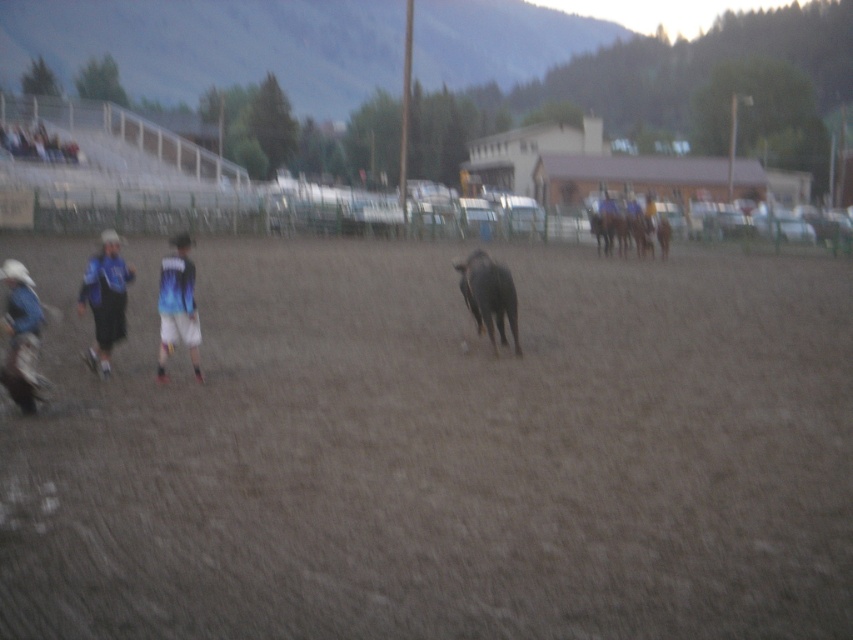
Question: Which of the following is the farthest from the observer?

Choices:
 (A) blue jersey at left
 (B) black matte bull at center
 (C) brown sandy dirt at center

Answer: (B)

Question: Which point is farther from the camera taking this photo?

Choices:
 (A) (498, 308)
 (B) (173, 298)
 (C) (102, 296)
 (D) (245, 460)

Answer: (A)

Question: Among these objects, which one is nearest to the camera?

Choices:
 (A) blue jersey at left
 (B) black matte bull at center
 (C) blue gradient jersey at center
 (D) brown sandy dirt at center

Answer: (D)

Question: Does brown sandy dirt at center have a larger size compared to blue jersey at left?

Choices:
 (A) no
 (B) yes

Answer: (B)

Question: Can you confirm if blue jersey at left is bigger than black matte bull at center?

Choices:
 (A) yes
 (B) no

Answer: (A)

Question: Is brown sandy dirt at center to the left of blue jersey at left from the viewer's perspective?

Choices:
 (A) no
 (B) yes

Answer: (A)